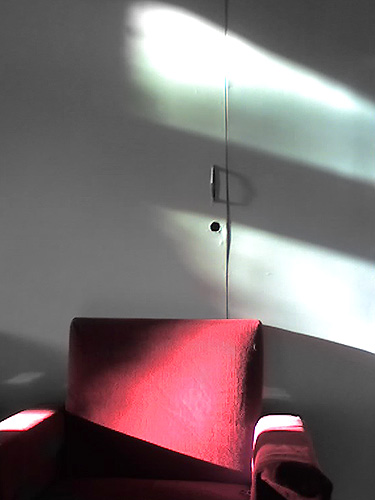
Locate an element on the screen. This screenshot has width=375, height=500. right armrest is located at coordinates (29, 421).